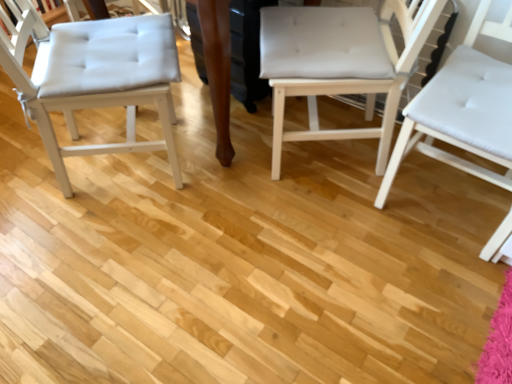
Question: Which direction should I rotate to face white fabric chair at center, which appears as the second chair when viewed from the right, — up or down?

Choices:
 (A) up
 (B) down

Answer: (A)

Question: Does white tufted cushion at left, which is the 1th chair in left-to-right order, turn towards white leather chair at right, acting as the first chair starting from the right?

Choices:
 (A) no
 (B) yes

Answer: (B)

Question: Does white tufted cushion at left, arranged as the third chair when viewed from the right, have a larger size compared to white leather chair at right, acting as the first chair starting from the right?

Choices:
 (A) no
 (B) yes

Answer: (B)

Question: Is white leather chair at right, placed as the 3th chair when sorted from left to right, surrounded by white tufted cushion at left, which is the 1th chair in left-to-right order?

Choices:
 (A) no
 (B) yes

Answer: (A)

Question: From the image's perspective, is white tufted cushion at left, arranged as the third chair when viewed from the right, below white leather chair at right, placed as the 3th chair when sorted from left to right?

Choices:
 (A) no
 (B) yes

Answer: (A)

Question: From a real-world perspective, does white tufted cushion at left, arranged as the third chair when viewed from the right, stand above white leather chair at right, placed as the 3th chair when sorted from left to right?

Choices:
 (A) no
 (B) yes

Answer: (A)

Question: From the image's perspective, does white tufted cushion at left, arranged as the third chair when viewed from the right, appear higher than white leather chair at right, placed as the 3th chair when sorted from left to right?

Choices:
 (A) no
 (B) yes

Answer: (B)

Question: Is the position of white leather chair at right, acting as the first chair starting from the right, more distant than that of white tufted cushion at left, which is the 1th chair in left-to-right order?

Choices:
 (A) no
 (B) yes

Answer: (A)

Question: From the image's perspective, is white leather chair at right, placed as the 3th chair when sorted from left to right, above white tufted cushion at left, arranged as the third chair when viewed from the right?

Choices:
 (A) no
 (B) yes

Answer: (A)

Question: From a real-world perspective, is white leather chair at right, placed as the 3th chair when sorted from left to right, on white tufted cushion at left, arranged as the third chair when viewed from the right?

Choices:
 (A) no
 (B) yes

Answer: (B)

Question: From a real-world perspective, is white leather chair at right, acting as the first chair starting from the right, positioned under white tufted cushion at left, which is the 1th chair in left-to-right order, based on gravity?

Choices:
 (A) no
 (B) yes

Answer: (A)

Question: Does white leather chair at right, placed as the 3th chair when sorted from left to right, touch white tufted cushion at left, which is the 1th chair in left-to-right order?

Choices:
 (A) no
 (B) yes

Answer: (A)

Question: Is white fabric chair at center, which appears as the second chair when viewed from the right, facing away from white tufted cushion at left, which is the 1th chair in left-to-right order?

Choices:
 (A) yes
 (B) no

Answer: (B)